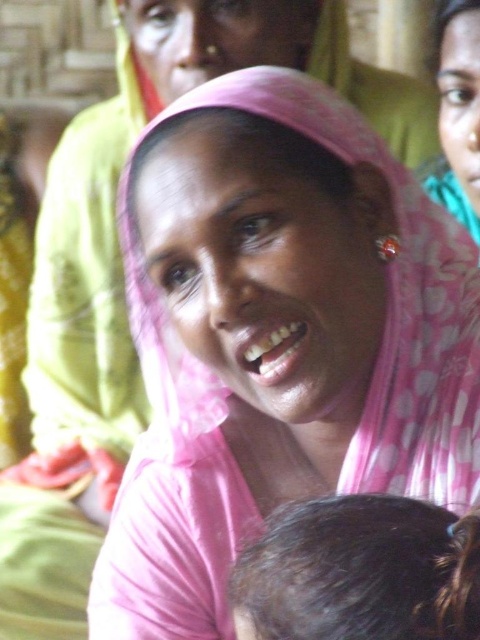
Between pink fabric headscarf at center and dark brown hair at lower center, which one is positioned lower?

Positioned lower is dark brown hair at lower center.

The width and height of the screenshot is (480, 640). What do you see at coordinates (394, 307) in the screenshot?
I see `pink fabric headscarf at center` at bounding box center [394, 307].

Find the location of a particular element. pink fabric headscarf at center is located at coordinates (394, 307).

Does pink fabric headscarf at center come in front of pink fabric headscarf at upper center?

Yes.

Is pink fabric headscarf at center thinner than pink fabric headscarf at upper center?

Incorrect, pink fabric headscarf at center's width is not less than pink fabric headscarf at upper center's.

Is point (477, 435) behind point (477, 232)?

No.

This screenshot has width=480, height=640. Find the location of `pink fabric headscarf at center`. pink fabric headscarf at center is located at coordinates (394, 307).

Which is above, dark brown hair at lower center or pink fabric headscarf at upper center?

pink fabric headscarf at upper center is above.

Is dark brown hair at lower center positioned in front of pink fabric headscarf at upper center?

Yes, it is in front of pink fabric headscarf at upper center.

Between point (286, 566) and point (466, 116), which one is positioned in front?

Point (286, 566)

Find the location of a particular element. Image resolution: width=480 pixels, height=640 pixels. dark brown hair at lower center is located at coordinates (360, 572).